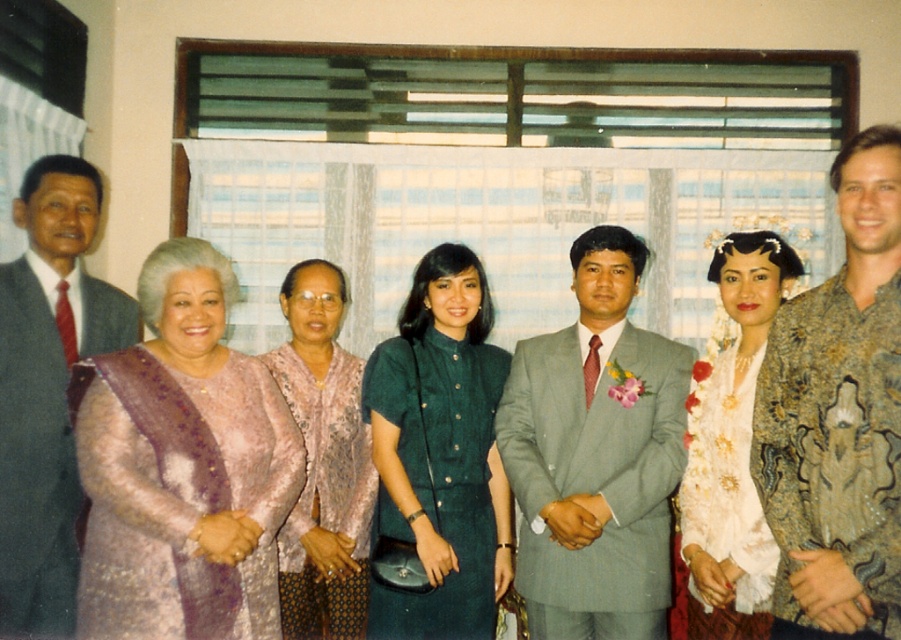
Question: Is light gray suit at center bigger than matte pink fabric at center?

Choices:
 (A) no
 (B) yes

Answer: (B)

Question: Estimate the real-world distances between objects in this image. Which object is farther from the light gray suit at center?

Choices:
 (A) matte black suit at left
 (B) batik shirt at center
 (C) white lace dress at center

Answer: (A)

Question: Can you confirm if white lace dress at center is positioned to the left of matte pink fabric at center?

Choices:
 (A) no
 (B) yes

Answer: (A)

Question: Which object is closer to the camera taking this photo?

Choices:
 (A) batik shirt at center
 (B) matte pink fabric at center
 (C) white lace dress at center
 (D) green textured dress at center

Answer: (A)

Question: Is white lace dress at center wider than matte pink fabric at center?

Choices:
 (A) no
 (B) yes

Answer: (A)

Question: Which point is closer to the camera?

Choices:
 (A) white lace dress at center
 (B) green textured dress at center
 (C) matte pink fabric at center

Answer: (A)